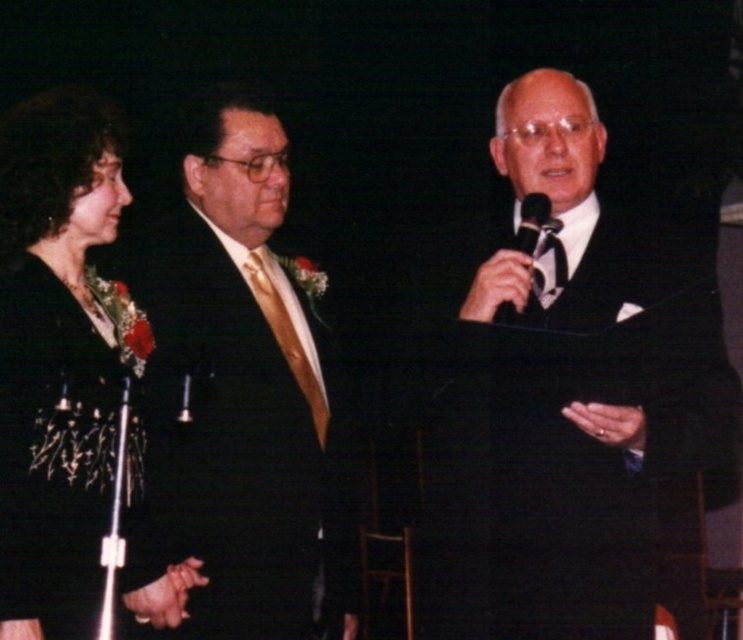
Question: Which point is closer to the camera taking this photo?

Choices:
 (A) (224, 312)
 (B) (565, 125)

Answer: (B)

Question: Which object is farther from the camera taking this photo?

Choices:
 (A) shiny gold tie at center
 (B) black silk suit at center
 (C) black metallic microphone at center

Answer: (A)

Question: In this image, where is black silk suit at center located relative to black metallic microphone at center?

Choices:
 (A) left
 (B) right

Answer: (B)

Question: Can you confirm if shiny gold tie at center is positioned above black metallic microphone at center?

Choices:
 (A) yes
 (B) no

Answer: (B)

Question: Which point is closer to the camera taking this photo?

Choices:
 (A) (557, 225)
 (B) (512, 310)

Answer: (B)

Question: Is shiny gold tie at center behind black satin dress at left?

Choices:
 (A) yes
 (B) no

Answer: (A)